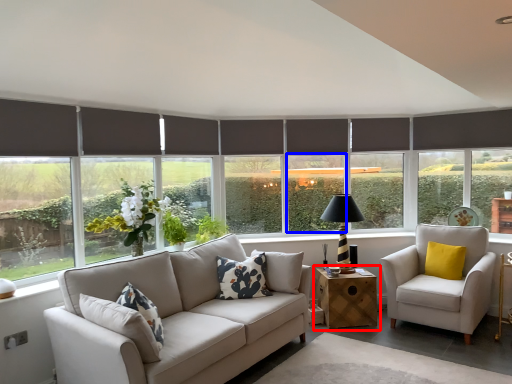
Question: Which point is further to the camera, table (highlighted by a red box) or window (highlighted by a blue box)?

Choices:
 (A) table
 (B) window

Answer: (B)